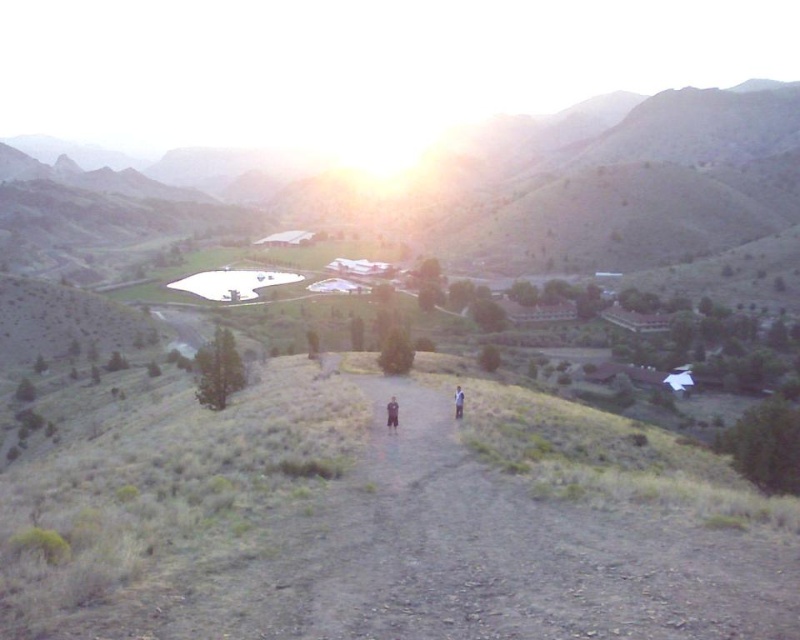
Looking at this image, is dark blue jeans at center positioned before light brown fabric shirt at center?

Yes.

Is dark blue jeans at center thinner than light brown fabric shirt at center?

Correct, dark blue jeans at center's width is less than light brown fabric shirt at center's.

The width and height of the screenshot is (800, 640). Find the location of `dark blue jeans at center`. dark blue jeans at center is located at coordinates (392, 412).

Locate an element on the screen. This screenshot has width=800, height=640. dark blue jeans at center is located at coordinates (392, 412).